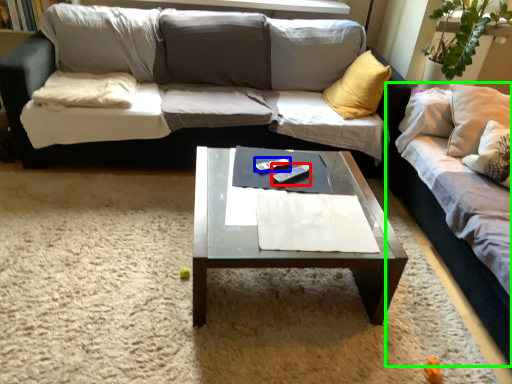
Question: Estimate the real-world distances between objects in this image. Which object is closer to remote (highlighted by a red box), remote (highlighted by a blue box) or studio couch (highlighted by a green box)?

Choices:
 (A) remote
 (B) studio couch

Answer: (A)